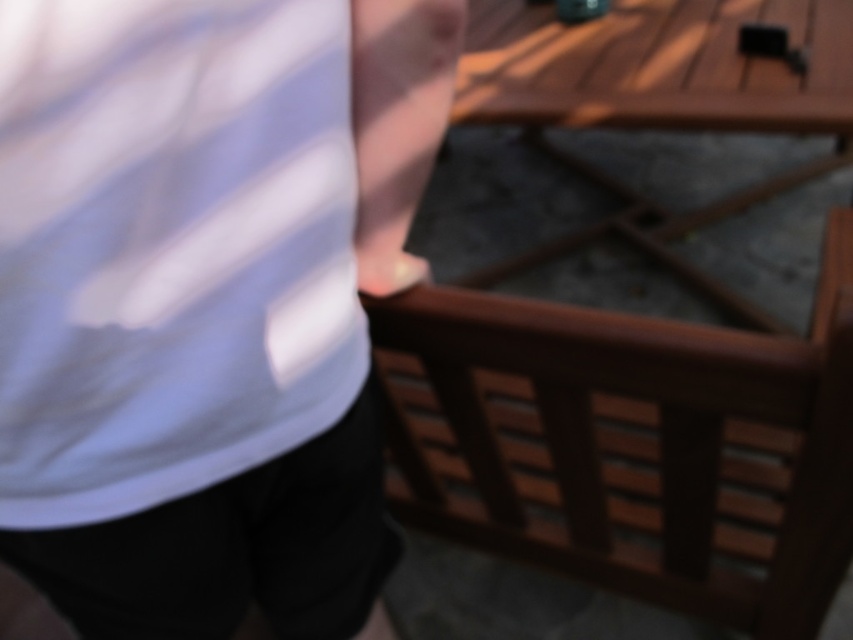
From the picture: You are standing at the point with coordinates point (753,538) and want to move to the wooden bench with slatted backrests. There is an obstacle at point (184,346). Will you be able to reach the bench without going around the obstacle?

Since point (184,346) is in front of point (753,538), the obstacle is blocking the path to the bench. Therefore, you will need to go around the obstacle to reach the bench.

You are a photographer trying to capture the black cotton shorts at lower left in focus while standing behind the brown wooden balustrade at right. Can you adjust your position so that the shorts are visible and in focus without moving the balustrade?

The black cotton shorts at lower left is behind the brown wooden balustrade at right, so you cannot adjust your position to make the shorts visible and in focus without moving the balustrade because the balustrade is blocking the view of the shorts.

You are trying to locate the brown wooden balustrade at right in the image. According to the scene, where should you look relative to the black cotton shorts at lower left?

The brown wooden balustrade at right is positioned on the right side of the black cotton shorts at lower left, so you should look to the right of the black cotton shorts at lower left to find it.